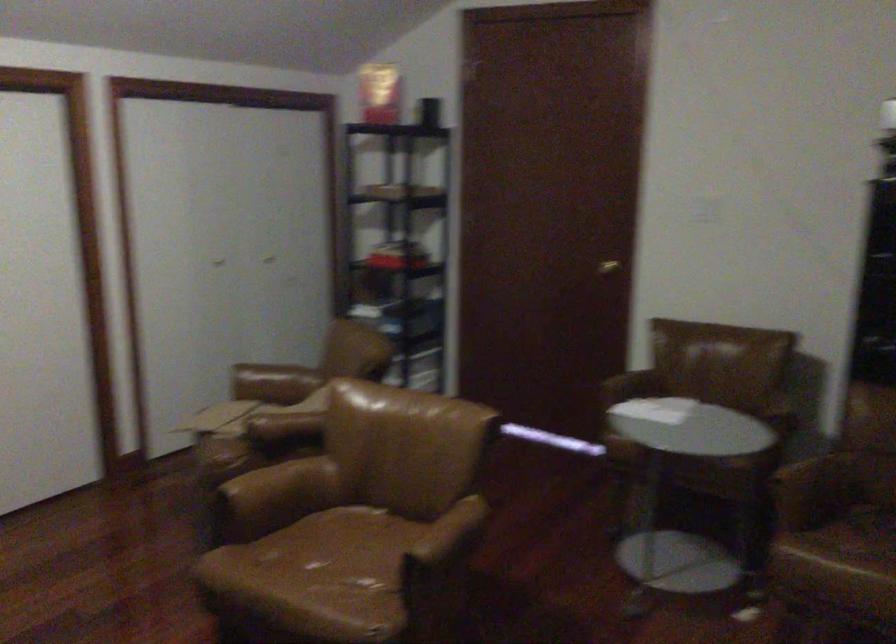
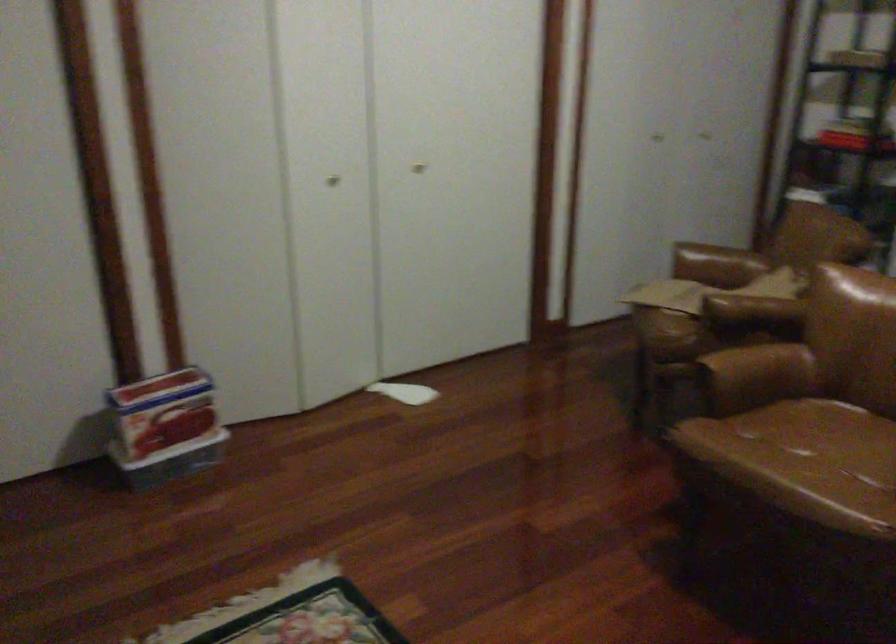
Question: Which direction would the cameraman need to move to produce the second image? Reply with the corresponding letter.

Choices:
 (A) Left
 (B) Right
 (C) Forward
 (D) Backward

Answer: (A)